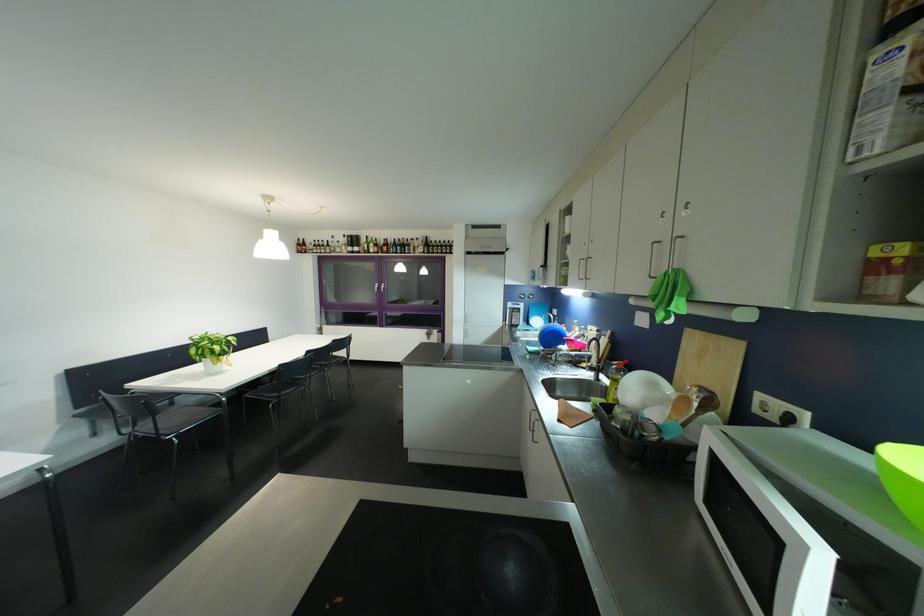
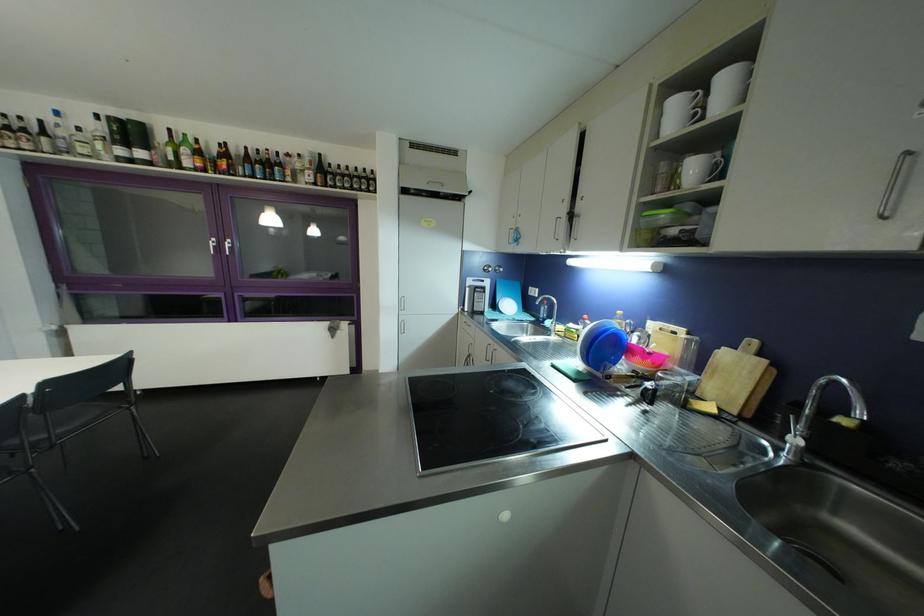
The point at (370, 243) is marked in the first image. Where is the corresponding point in the second image?

(167, 140)